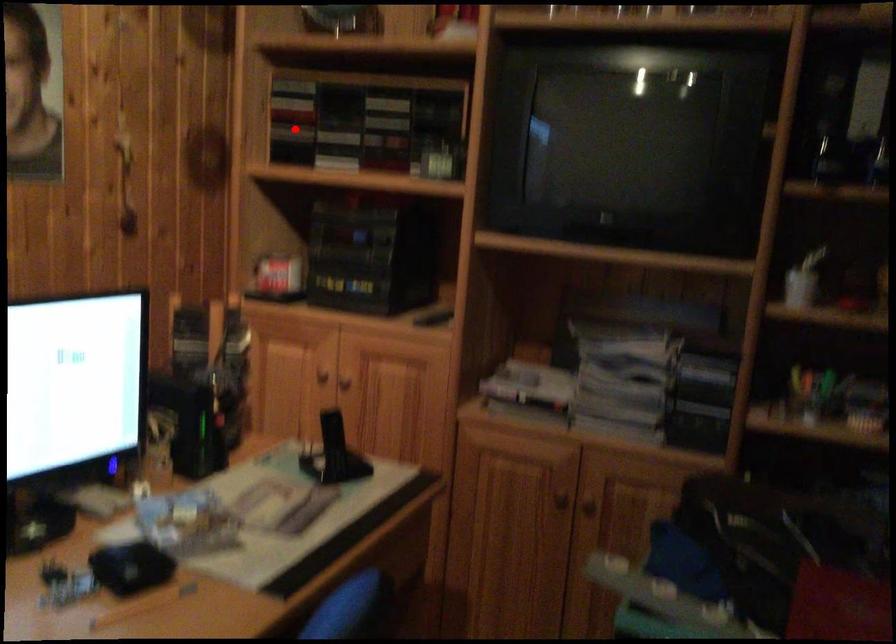
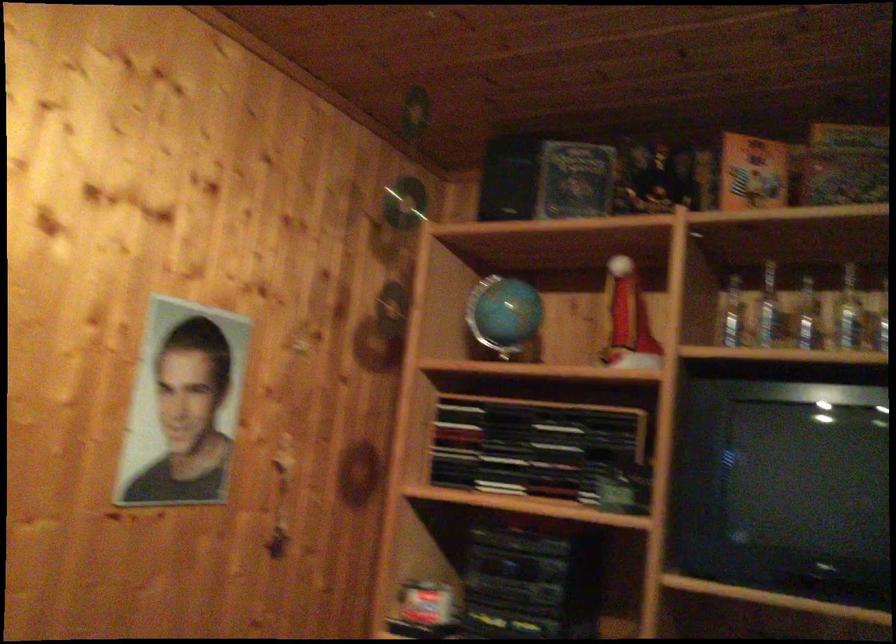
Where in the second image is the point corresponding to the highlighted location from the first image?

(454, 442)